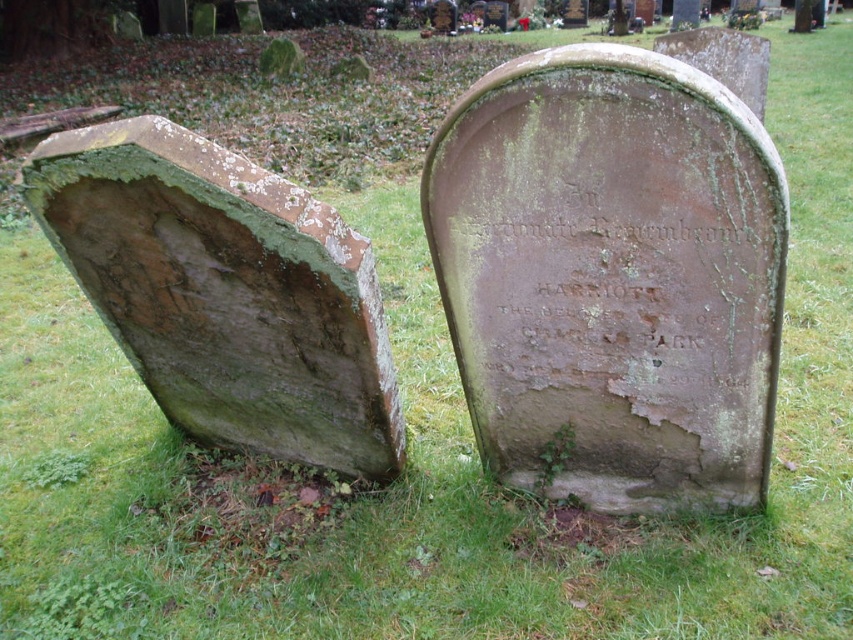
Question: From the image, what is the correct spatial relationship of green mossy stone at center in relation to green mossy stone at left?

Choices:
 (A) right
 (B) left

Answer: (A)

Question: Does green mossy stone at center appear on the right side of green mossy stone at left?

Choices:
 (A) yes
 (B) no

Answer: (A)

Question: Among these points, which one is nearest to the camera?

Choices:
 (A) (709, 308)
 (B) (328, 300)

Answer: (A)

Question: Does green mossy stone at center come behind green mossy stone at left?

Choices:
 (A) no
 (B) yes

Answer: (A)